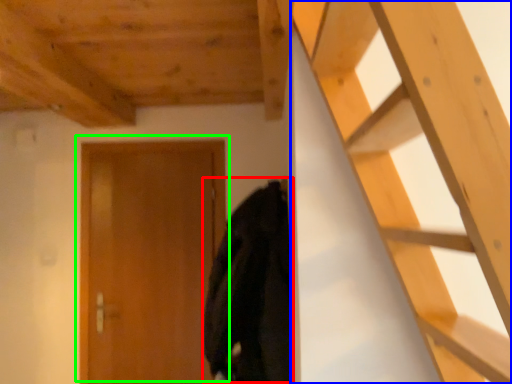
Question: Estimate the real-world distances between objects in this image. Which object is farther from cloak (highlighted by a red box), ladder (highlighted by a blue box) or door (highlighted by a green box)?

Choices:
 (A) ladder
 (B) door

Answer: (A)